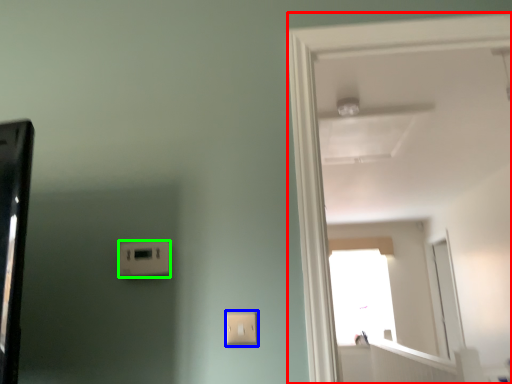
Question: Estimate the real-world distances between objects in this image. Which object is closer to door (highlighted by a red box), light switch (highlighted by a blue box) or light switch (highlighted by a green box)?

Choices:
 (A) light switch
 (B) light switch

Answer: (A)